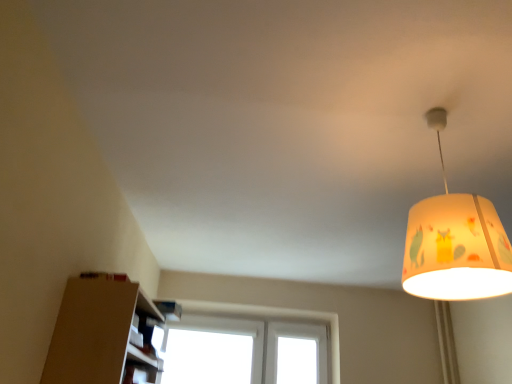
Question: Is yellow fabric lampshade at upper right taller or shorter than white plastic window at center?

Choices:
 (A) tall
 (B) short

Answer: (B)

Question: Relative to white plastic window at center, is yellow fabric lampshade at upper right in front or behind?

Choices:
 (A) behind
 (B) front

Answer: (B)

Question: From the image's perspective, is yellow fabric lampshade at upper right located above or below white plastic window at center?

Choices:
 (A) above
 (B) below

Answer: (A)

Question: From the image's perspective, is white plastic window at center located above or below yellow fabric lampshade at upper right?

Choices:
 (A) below
 (B) above

Answer: (A)

Question: From a real-world perspective, is white plastic window at center positioned above or below yellow fabric lampshade at upper right?

Choices:
 (A) above
 (B) below

Answer: (B)

Question: Would you say white plastic window at center is to the left or to the right of yellow fabric lampshade at upper right in the picture?

Choices:
 (A) left
 (B) right

Answer: (A)

Question: In the image, is white plastic window at center positioned in front of or behind yellow fabric lampshade at upper right?

Choices:
 (A) front
 (B) behind

Answer: (B)